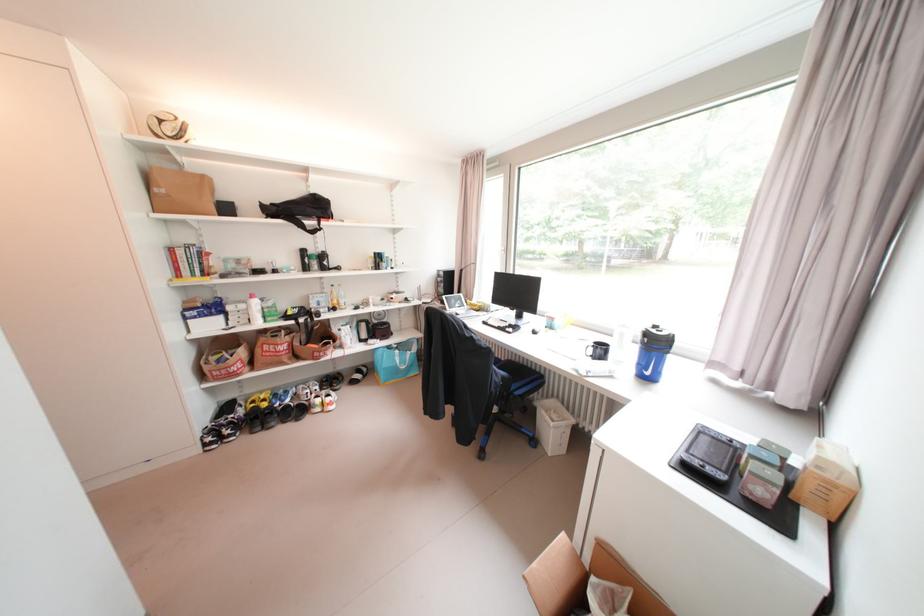
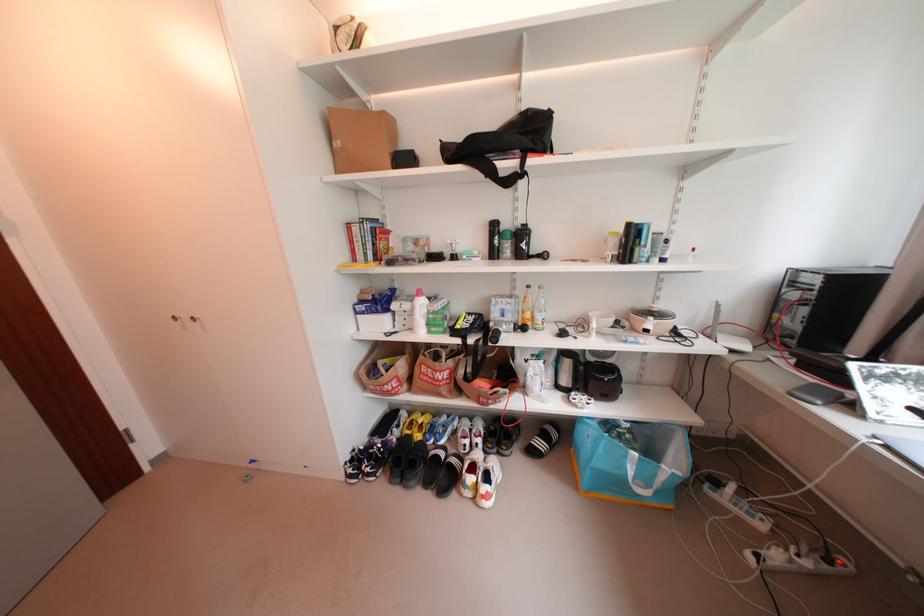
The point at (342, 294) is marked in the first image. Where is the corresponding point in the second image?

(536, 301)